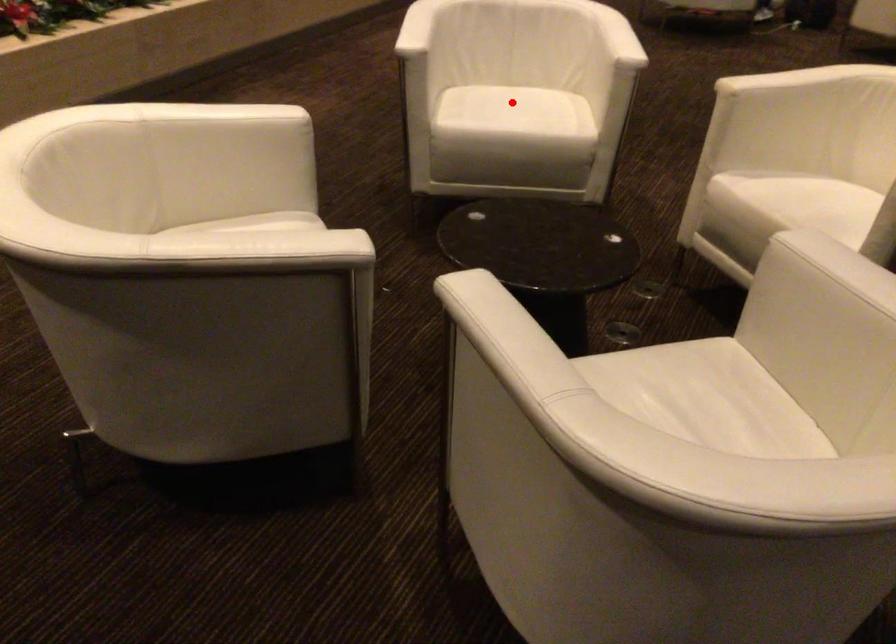
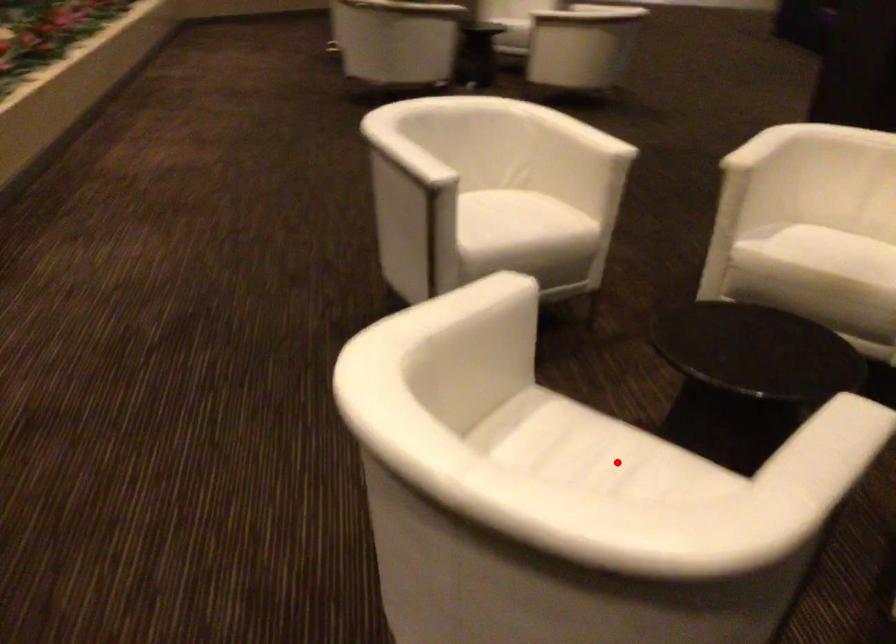
In the scene shown: I am providing you with two images of the same scene from different viewpoints. A red point is marked on the first image and another point is marked on the second image. Is the red point in image1 aligned with the point shown in image2?

No